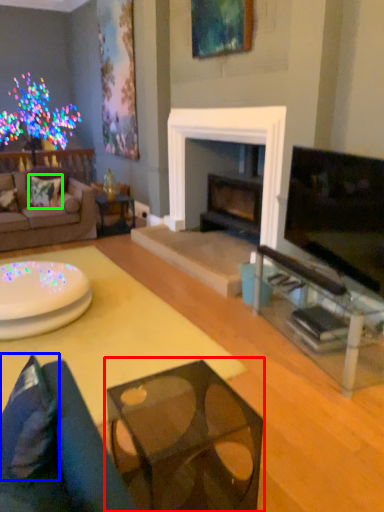
Question: Based on their relative distances, which object is farther from table (highlighted by a red box)? Choose from pillow (highlighted by a blue box) and pillow (highlighted by a green box).

Choices:
 (A) pillow
 (B) pillow

Answer: (B)